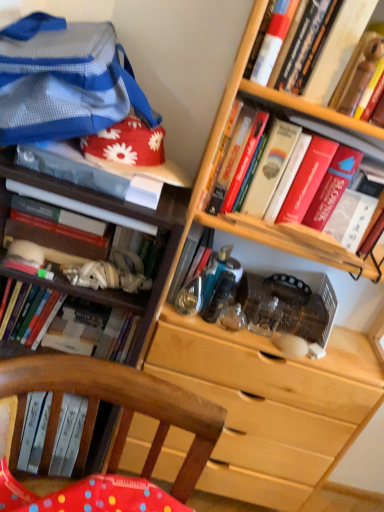
Question: Which direction should I rotate to look at metallic blue book at center, which appears as the 5th book when viewed from the right, — up or down?

Choices:
 (A) down
 (B) up

Answer: (A)

Question: Considering the relative positions of hardcover book at center-left, the 8th book in the right-to-left sequence, and hardcover book at left, positioned as the 7th book in right-to-left order, in the image provided, is hardcover book at center-left, the 8th book in the right-to-left sequence, to the left of hardcover book at left, positioned as the 7th book in right-to-left order, from the viewer's perspective?

Choices:
 (A) no
 (B) yes

Answer: (B)

Question: Does hardcover book at center-left, which appears as the 2th book when viewed from the left, appear on the right side of hardcover book at left, positioned as the 7th book in right-to-left order?

Choices:
 (A) no
 (B) yes

Answer: (A)

Question: From the image's perspective, would you say hardcover book at center-left, which appears as the 2th book when viewed from the left, is shown under hardcover book at left, which is the 3th book in left-to-right order?

Choices:
 (A) no
 (B) yes

Answer: (B)

Question: Is hardcover book at center-left, the 8th book in the right-to-left sequence, bigger than hardcover book at left, which is the 3th book in left-to-right order?

Choices:
 (A) yes
 (B) no

Answer: (A)

Question: Does hardcover book at center-left, which appears as the 2th book when viewed from the left, have a lesser height compared to hardcover book at left, which is the 3th book in left-to-right order?

Choices:
 (A) no
 (B) yes

Answer: (A)

Question: Is hardcover book at center-left, the 8th book in the right-to-left sequence, in front of hardcover book at left, which is the 3th book in left-to-right order?

Choices:
 (A) no
 (B) yes

Answer: (A)

Question: Could you tell me if blue striped fabric at upper left is turned towards hardcover book at left, the first book from the left?

Choices:
 (A) yes
 (B) no

Answer: (B)

Question: Can we say blue striped fabric at upper left lies outside hardcover book at left, the first book from the left?

Choices:
 (A) no
 (B) yes

Answer: (B)

Question: From the image's perspective, is blue striped fabric at upper left over hardcover book at left, the first book from the left?

Choices:
 (A) no
 (B) yes

Answer: (B)

Question: Does blue striped fabric at upper left have a smaller size compared to hardcover book at left, arranged as the 9th book when viewed from the right?

Choices:
 (A) no
 (B) yes

Answer: (A)

Question: Does blue striped fabric at upper left have a greater width compared to hardcover book at left, arranged as the 9th book when viewed from the right?

Choices:
 (A) yes
 (B) no

Answer: (A)

Question: Is hardcover book at left, the first book from the left, inside blue striped fabric at upper left?

Choices:
 (A) yes
 (B) no

Answer: (B)

Question: Can you confirm if metallic blue book at center, which ranks as the fifth book in left-to-right order, is positioned to the left of hardcover book at center-left, the 8th book in the right-to-left sequence?

Choices:
 (A) no
 (B) yes

Answer: (A)